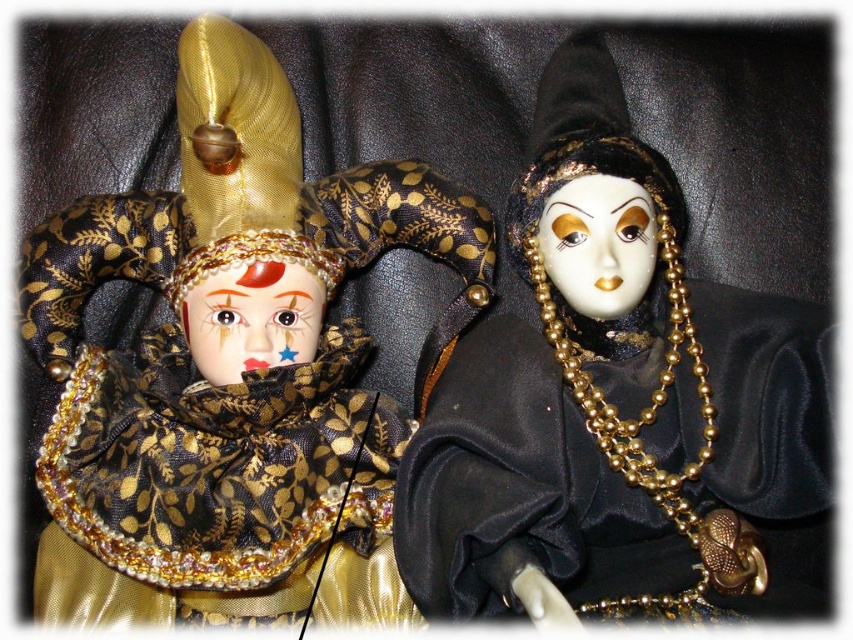
Question: Does gold brocade jester at center come in front of porcelain mask at center?

Choices:
 (A) yes
 (B) no

Answer: (A)

Question: Which point is farther to the camera?

Choices:
 (A) porcelain mask at center
 (B) porcelain face at center
 (C) black satin doll at center
 (D) gold brocade jester at center

Answer: (B)

Question: Can you confirm if porcelain mask at center is wider than porcelain face at center?

Choices:
 (A) yes
 (B) no

Answer: (B)

Question: Which point appears farthest from the camera in this image?

Choices:
 (A) (641, 224)
 (B) (181, 307)
 (C) (260, 333)
 (D) (576, 61)

Answer: (D)

Question: Can you confirm if black satin doll at center is positioned to the right of porcelain mask at center?

Choices:
 (A) no
 (B) yes

Answer: (B)

Question: Considering the real-world distances, which object is closest to the porcelain mask at center?

Choices:
 (A) gold brocade jester at center
 (B) black satin doll at center
 (C) porcelain face at center

Answer: (B)